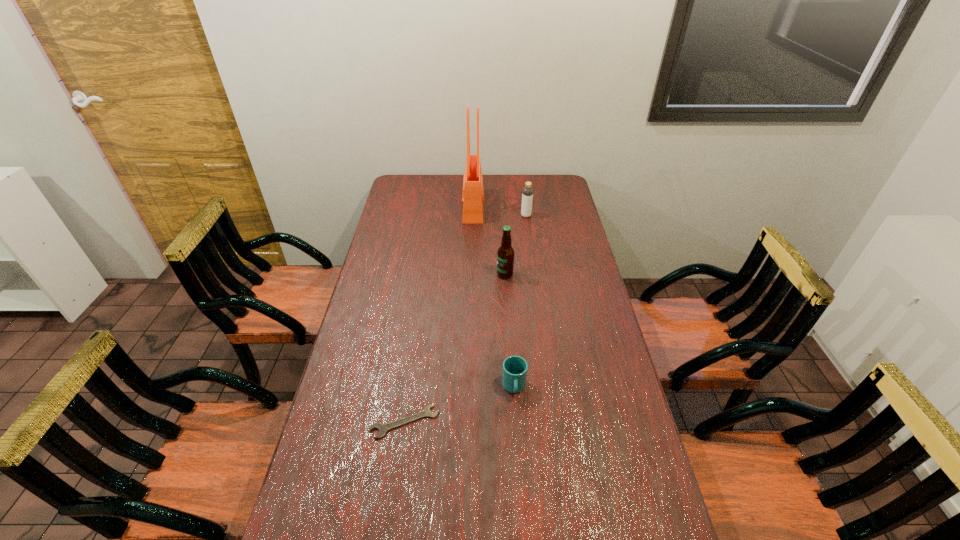
This screenshot has width=960, height=540. In order to click on empty space between the fourth shortest object and the bottle in this screenshot , I will do `click(516, 245)`.

At what (x,y) coordinates should I click in order to perform the action: click on empty location between the rightmost object and the nearest object. Please return your answer as a coordinate pair (x, y). Looking at the image, I should click on (466, 319).

This screenshot has height=540, width=960. In order to click on the fourth closest object to the tallest object in this screenshot , I will do `click(382, 428)`.

Locate which object ranks second in proximity to the nearest object. Please provide its 2D coordinates. Your answer should be formatted as a tuple, i.e. [(x, y)], where the tuple contains the x and y coordinates of a point satisfying the conditions above.

[(505, 255)]

The image size is (960, 540). I want to click on vacant position in the image that satisfies the following two spatial constraints: 1. on the back side of the bottle; 2. on the logo side of the tote bag, so click(x=525, y=207).

This screenshot has width=960, height=540. Identify the location of vacant region that satisfies the following two spatial constraints: 1. on the logo side of the second object from left to right; 2. on the front side of the shortest object. (468, 422).

Identify the location of vacant space that satisfies the following two spatial constraints: 1. on the logo side of the tote bag; 2. on the front side of the shortest object. The height and width of the screenshot is (540, 960). (468, 422).